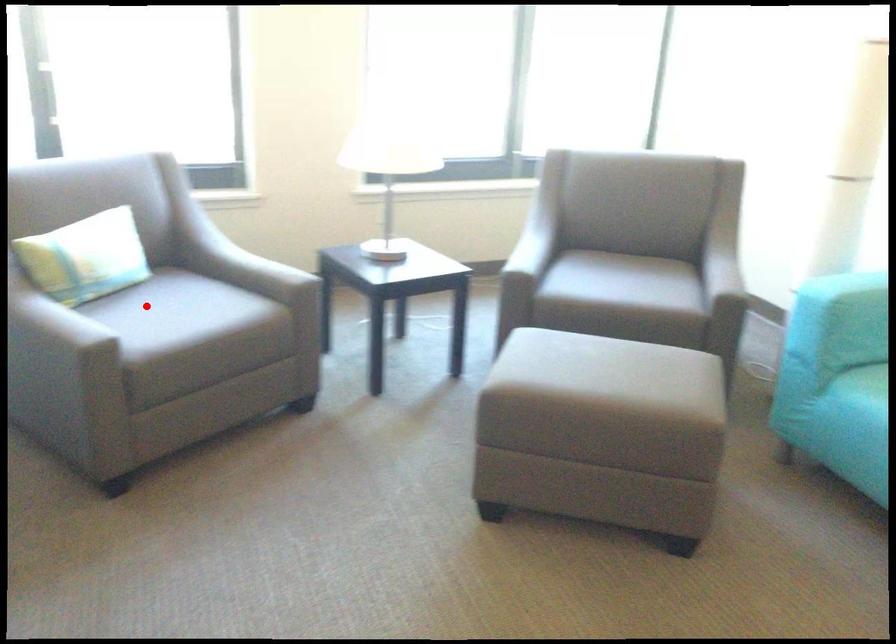
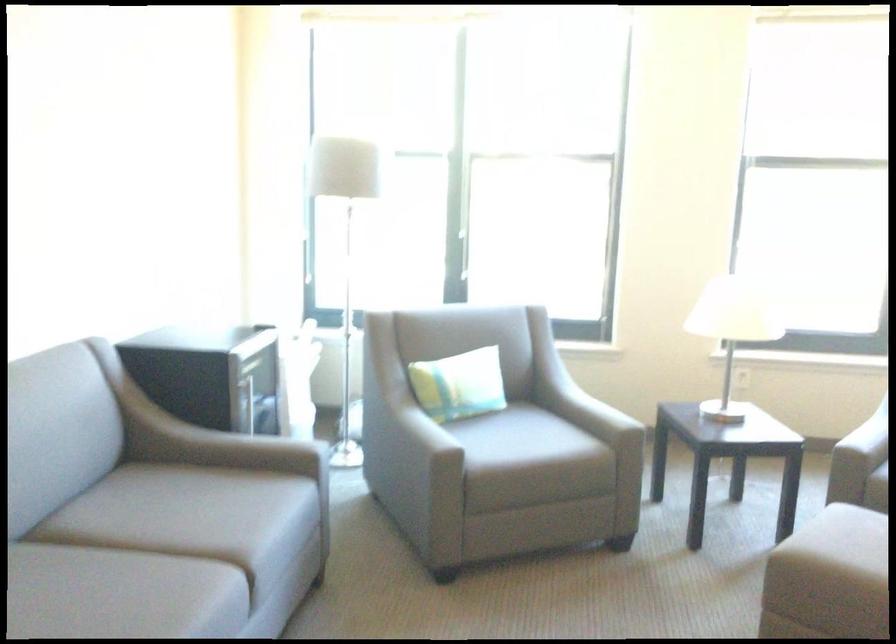
Question: I am providing you with two images of the same scene from different viewpoints. In image1, a red point is highlighted. Considering the same 3D point in image2, which of the following is correct?

Choices:
 (A) It is closer
 (B) It is farther

Answer: (B)